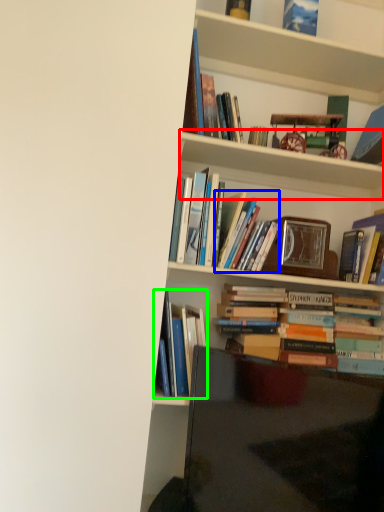
Question: Based on their relative distances, which object is farther from cabinet (highlighted by a red box)? Choose from book (highlighted by a blue box) and book (highlighted by a green box).

Choices:
 (A) book
 (B) book

Answer: (B)